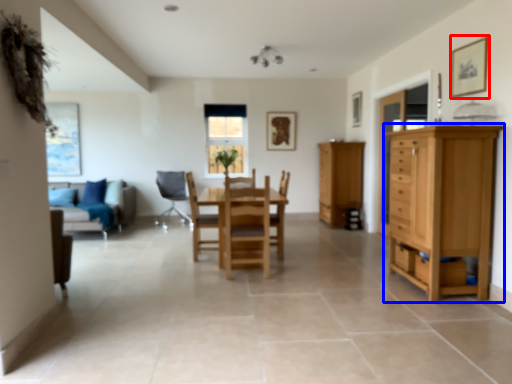
Question: Which of the following is the closest to the observer, picture frame (highlighted by a red box) or cupboard (highlighted by a blue box)?

Choices:
 (A) picture frame
 (B) cupboard

Answer: (B)